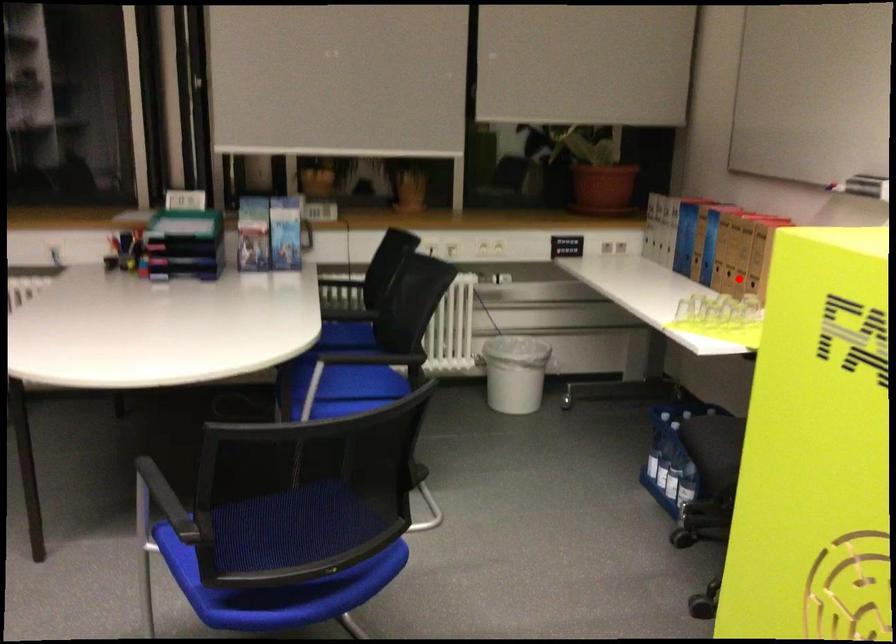
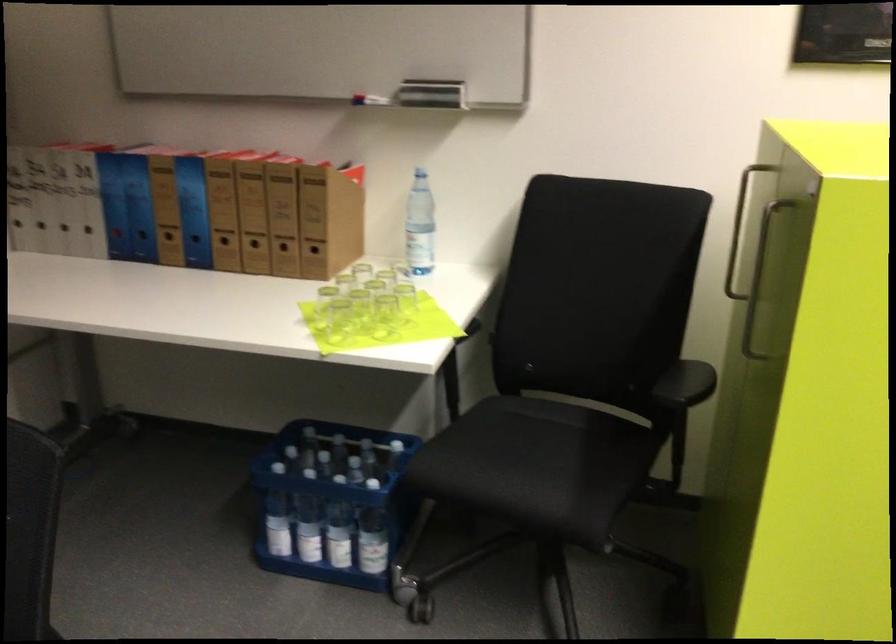
Question: I am providing you with two images of the same scene from different viewpoints. In image1, a red point is highlighted. Considering the same 3D point in image2, which of the following is correct?

Choices:
 (A) It is closer
 (B) It is farther

Answer: (A)